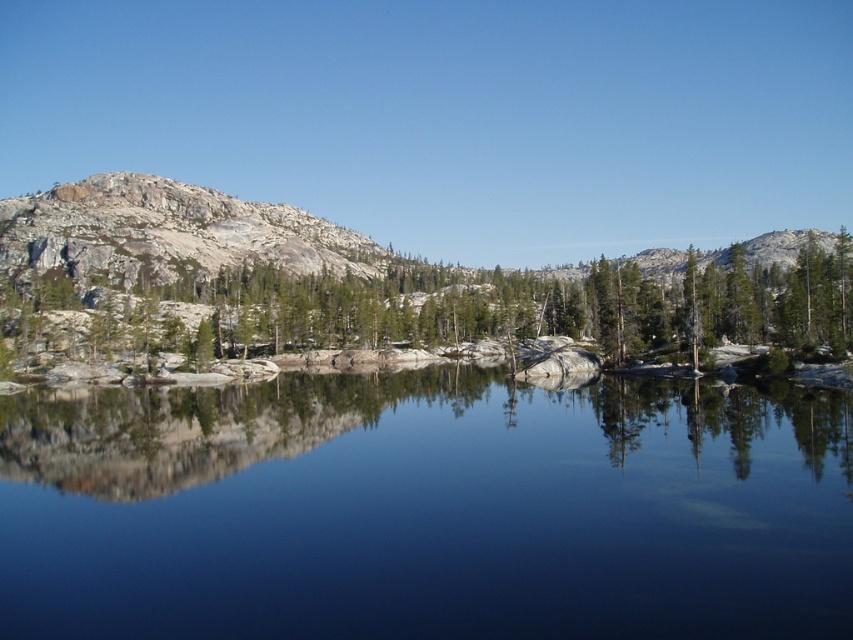
Question: Can you confirm if transparent glass lake at center is wider than granite rock formation at left?

Choices:
 (A) no
 (B) yes

Answer: (A)

Question: Which of the following is the farthest from the observer?

Choices:
 (A) (164, 259)
 (B) (134, 468)
 (C) (109, 349)

Answer: (A)

Question: Observing the image, what is the correct spatial positioning of transparent glass lake at center in reference to green textured rock at left?

Choices:
 (A) above
 (B) below

Answer: (B)

Question: Does transparent glass lake at center come in front of granite rock formation at left?

Choices:
 (A) no
 (B) yes

Answer: (B)

Question: Among these objects, which one is farthest from the camera?

Choices:
 (A) green textured rock at left
 (B) granite rock formation at left
 (C) transparent glass lake at center

Answer: (B)

Question: Which object is positioned farthest from the transparent glass lake at center?

Choices:
 (A) green textured rock at left
 (B) granite rock formation at left

Answer: (B)